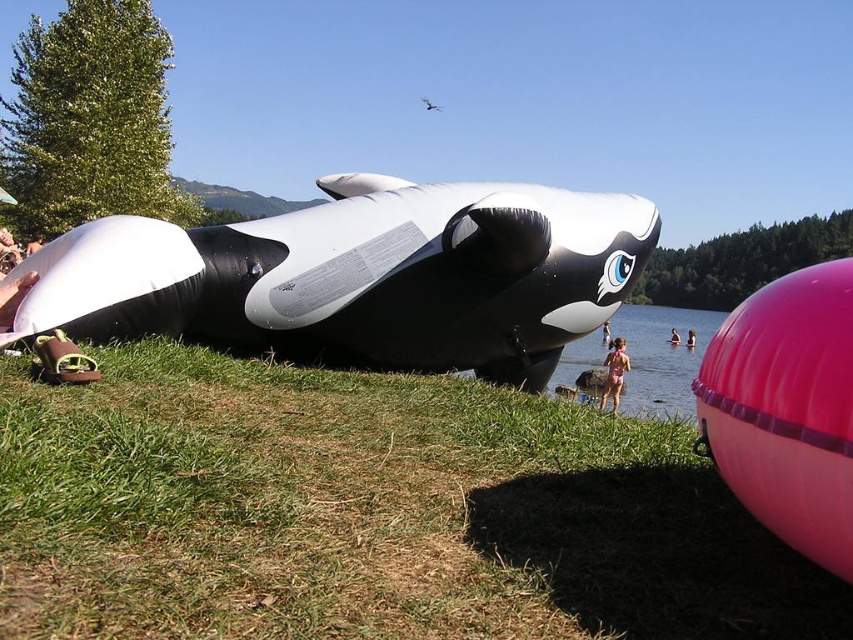
Does green grass at lower left have a greater width compared to pink rubber ball at lower right?

Correct, the width of green grass at lower left exceeds that of pink rubber ball at lower right.

Find the location of a particular element. green grass at lower left is located at coordinates (369, 513).

Which is more to the left, black rubber whale at center or pink rubber tube at lower right?

From the viewer's perspective, black rubber whale at center appears more on the left side.

Does black rubber whale at center have a greater height compared to pink rubber tube at lower right?

Correct, black rubber whale at center is much taller as pink rubber tube at lower right.

The width and height of the screenshot is (853, 640). I want to click on black rubber whale at center, so [360, 276].

Where is `black rubber whale at center`? black rubber whale at center is located at coordinates (360, 276).

Based on the photo, between pink rubber ball at lower right and pink rubber tube at lower right, which one appears on the right side from the viewer's perspective?

From the viewer's perspective, pink rubber ball at lower right appears more on the right side.

Who is more distant from viewer, [694,342] or [675,337]?

Positioned behind is point [694,342].

Where is `pink rubber ball at lower right`? pink rubber ball at lower right is located at coordinates (689, 339).

I want to click on pink rubber ball at lower right, so click(689, 339).